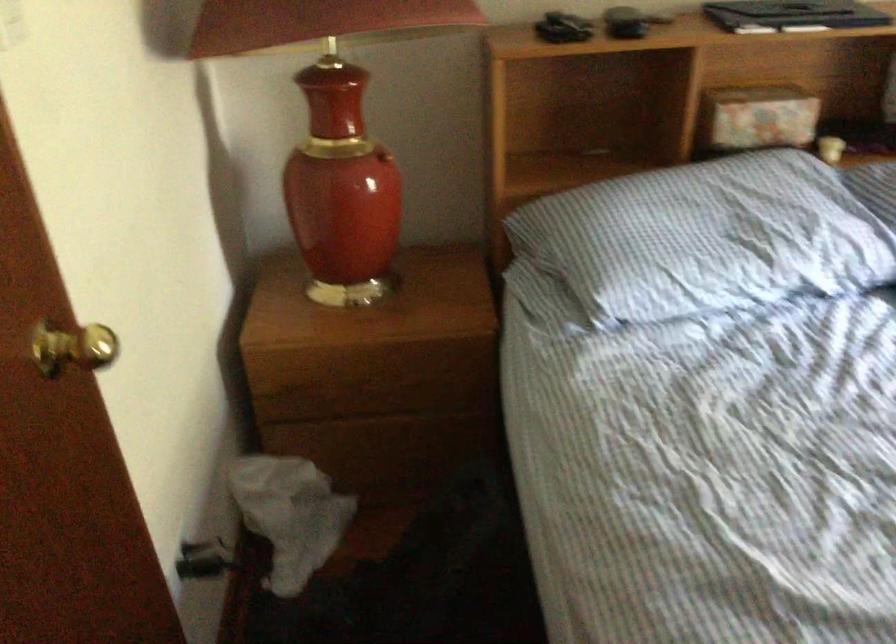
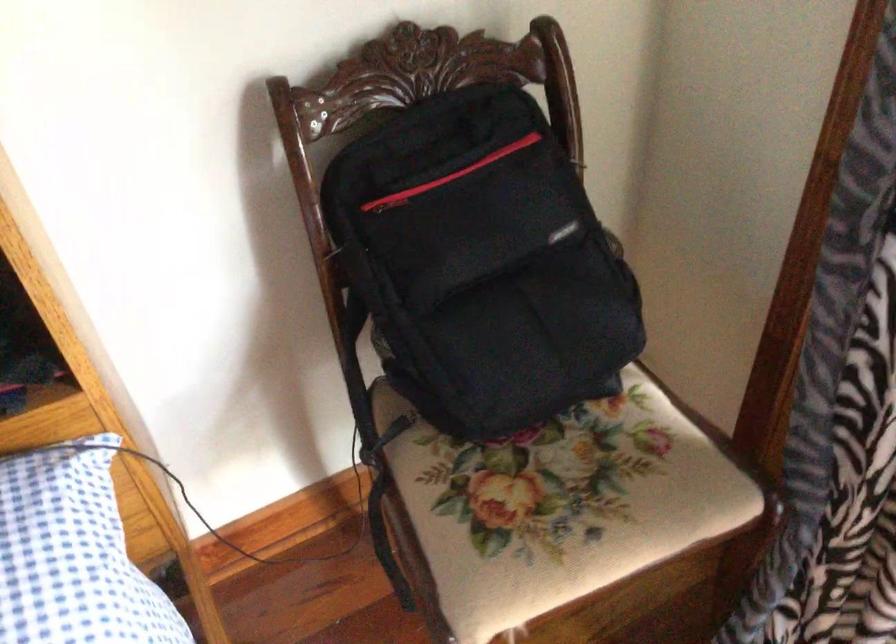
What movement of the cameraman would produce the second image?

The movement direction of the cameraman is right, forward.